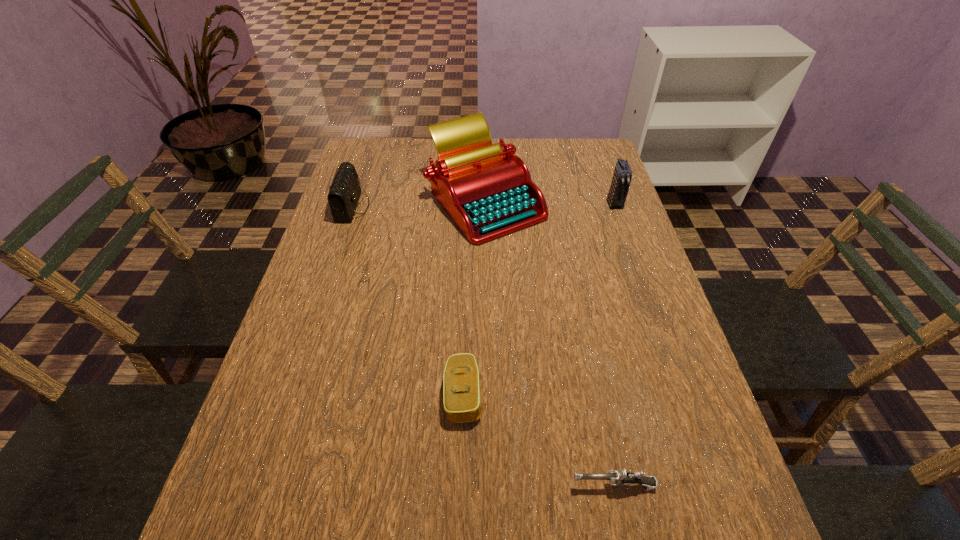
The height and width of the screenshot is (540, 960). Identify the location of free space that satisfies the following two spatial constraints: 1. with the zip open on the tallest clutch bag; 2. on the front flap of the leftmost clutch bag. (615, 207).

Identify the location of vacant region that satisfies the following two spatial constraints: 1. on the typing side of the tallest object; 2. on the front flap of the third shortest object. This screenshot has width=960, height=540. (486, 207).